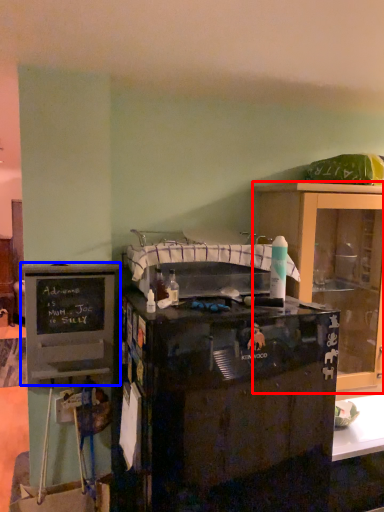
Question: Which object appears closest to the camera in this image, cabinetry (highlighted by a red box) or cabinetry (highlighted by a blue box)?

Choices:
 (A) cabinetry
 (B) cabinetry

Answer: (B)